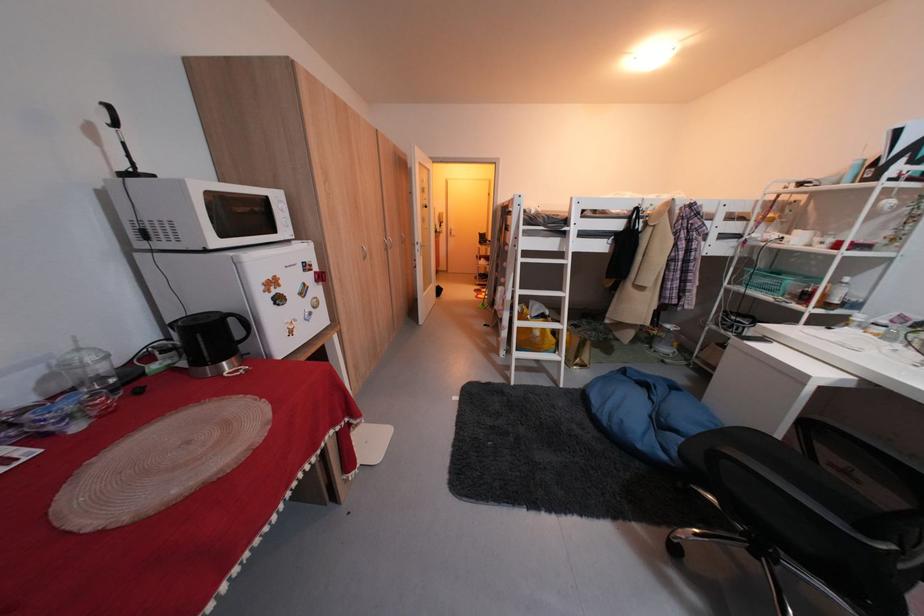
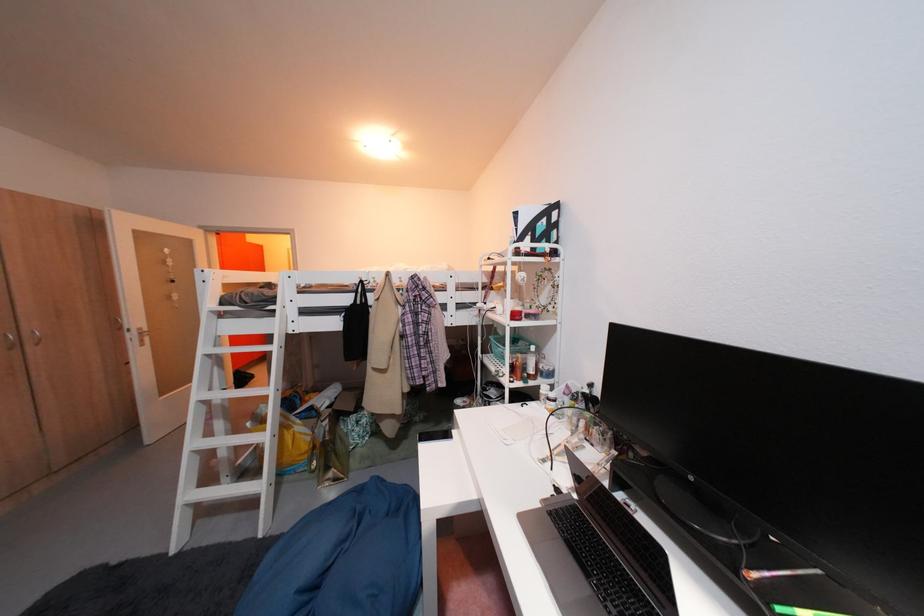
Find the pixel in the second image that matches (781,294) in the first image.

(514, 363)